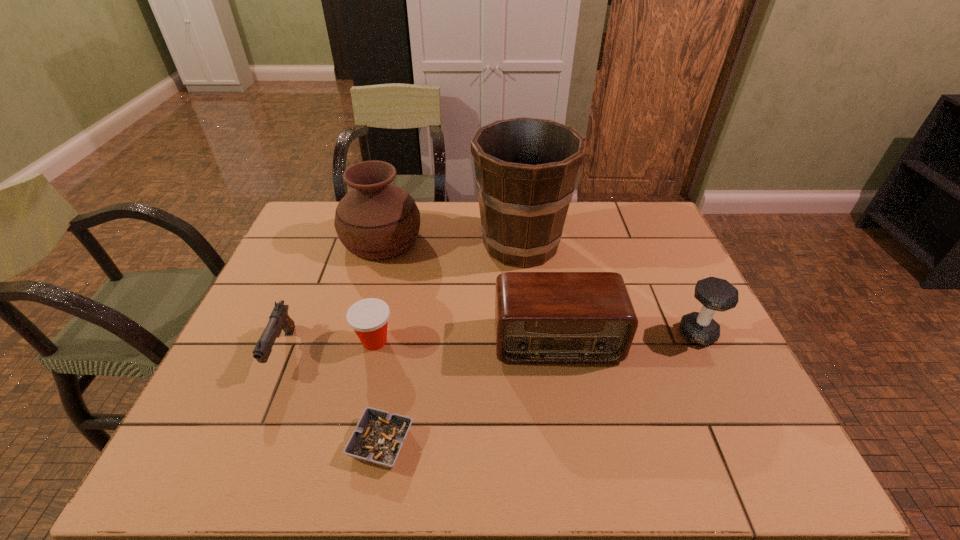
Find the location of a particular element. The image size is (960, 540). vacant space situated on the front panel of the radio receiver is located at coordinates (575, 452).

Locate an element on the screen. free region located 0.200m on the front of the dumbbell is located at coordinates click(x=739, y=421).

Where is `vacant region located in the direction the gun is aimed`? vacant region located in the direction the gun is aimed is located at coordinates (262, 399).

Identify the location of free region located 0.280m on the front of the Dixie cup. (346, 470).

I want to click on vacant space located 0.320m on the right of the ashtray, so click(566, 443).

The image size is (960, 540). What are the coordinates of `bucket present at the far edge` in the screenshot? It's located at (526, 168).

This screenshot has height=540, width=960. I want to click on urn present at the far edge, so click(376, 219).

At what (x,y) coordinates should I click in order to perform the action: click on object situated at the near edge. Please return your answer as a coordinate pair (x, y). The width and height of the screenshot is (960, 540). Looking at the image, I should click on (379, 436).

What are the coordinates of `object situated at the left edge` in the screenshot? It's located at (279, 319).

Locate an element on the screen. The image size is (960, 540). object that is at the right edge is located at coordinates click(x=715, y=294).